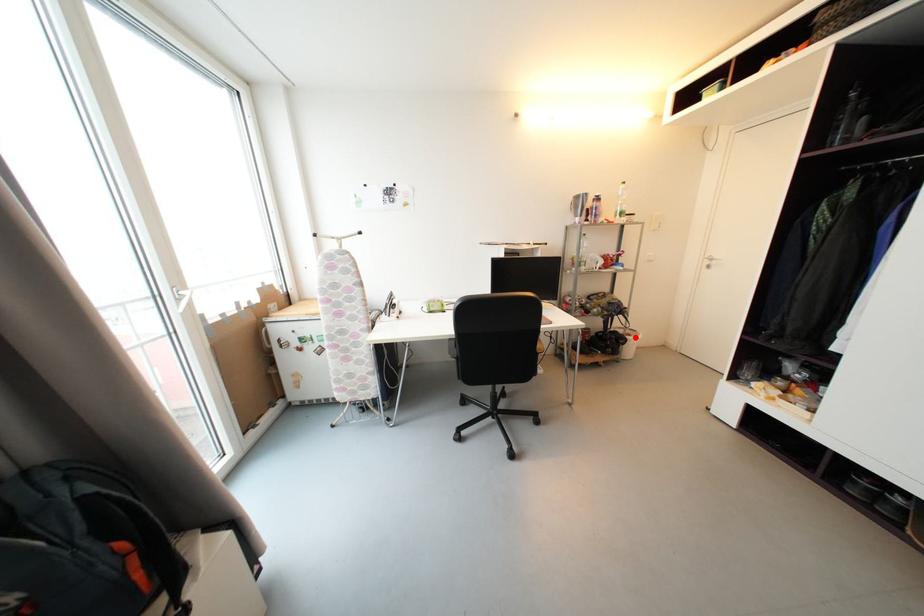
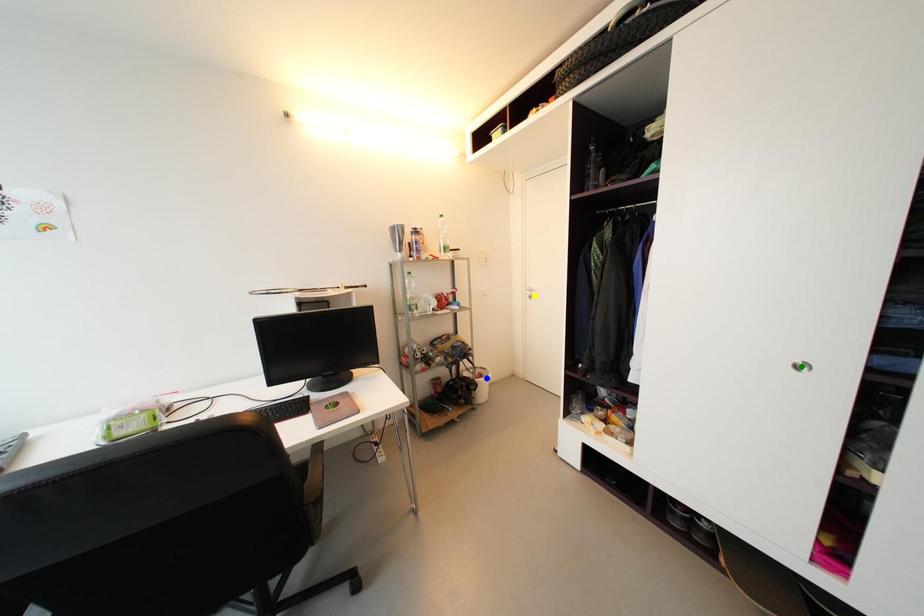
Question: I am providing you with two images of the same scene from different viewpoints. A red point is marked on the first image. You are given multiple points on the second image. Can you choose the point in image 2 that corresponds to the point in image 1?

Choices:
 (A) blue point
 (B) yellow point
 (C) green point

Answer: (A)